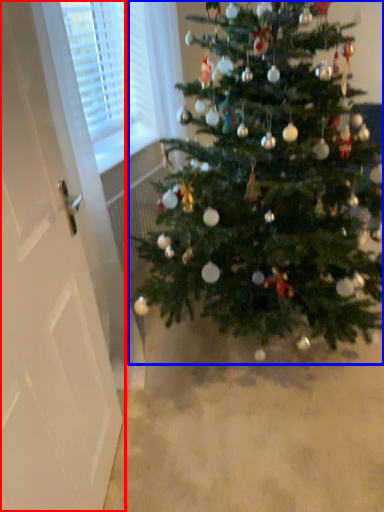
Question: Which of the following is the closest to the observer, screen door (highlighted by a red box) or christmas tree (highlighted by a blue box)?

Choices:
 (A) screen door
 (B) christmas tree

Answer: (A)